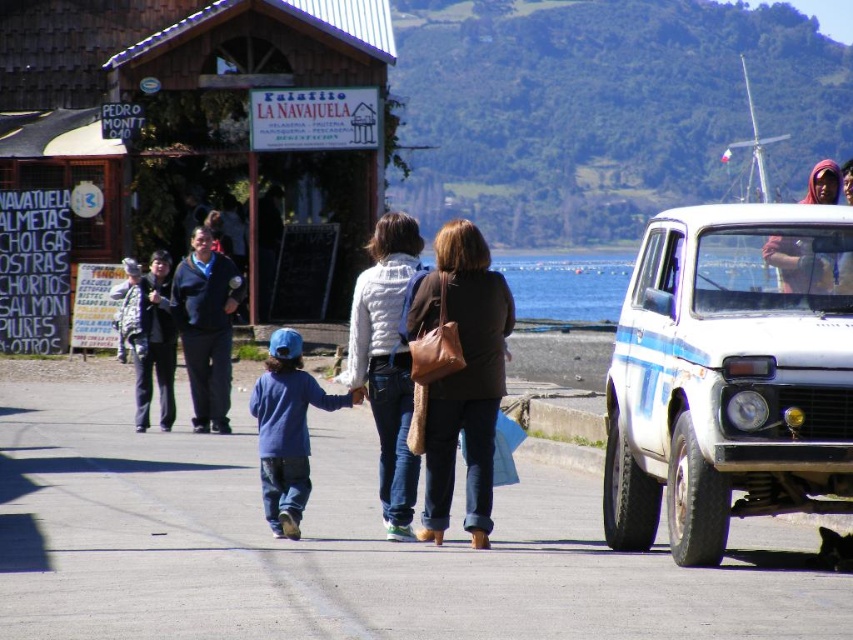
Question: Which point appears closest to the camera in this image?

Choices:
 (A) (212, 337)
 (B) (819, 180)
 (C) (469, 497)
 (D) (263, 477)

Answer: (C)

Question: Which of these objects is positioned farthest from the white matte car at right?

Choices:
 (A) blue cotton shirt at center
 (B) dark blue sweater at center

Answer: (B)

Question: Does white matte car at right have a greater width compared to blue cotton shirt at center?

Choices:
 (A) yes
 (B) no

Answer: (B)

Question: Among these points, which one is farthest from the camera?

Choices:
 (A) (786, 252)
 (B) (648, 273)
 (C) (401, 218)

Answer: (C)

Question: Does dark blue sweater at center have a smaller size compared to matte pink scarf at upper right?

Choices:
 (A) yes
 (B) no

Answer: (A)

Question: Does blue denim jacket at center lie in front of dark blue sweater at center?

Choices:
 (A) no
 (B) yes

Answer: (B)